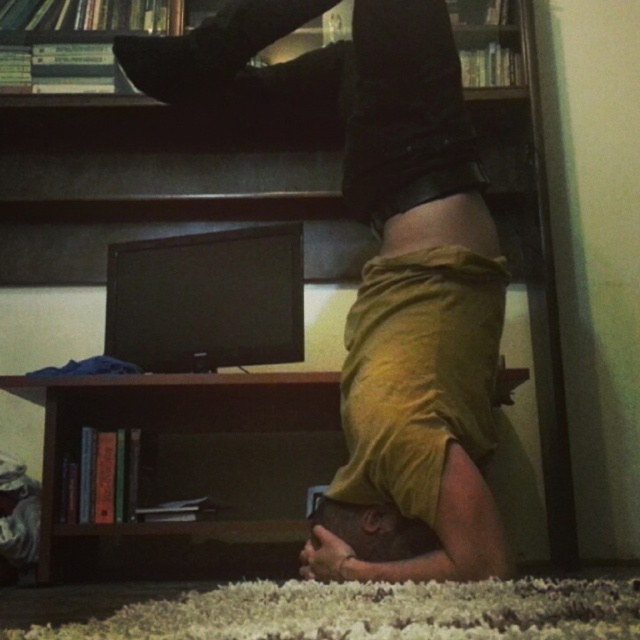
You are trying to hang a picture frame that requires a hook placed at a height of 2 meters. You have two options in the room where the mustard yellow fabric at center and the brown wood bookshelf at lower center are present. Which object would allow you to reach the required height for hanging the picture frame?

The mustard yellow fabric at center is much taller than the brown wood bookshelf at lower center, so you should use the mustard yellow fabric at center to reach the required height of 2 meters for hanging the picture frame.

You are organizing a room and need to place a new decorative item. The mustard yellow fabric at center and the brown wood bookshelf at lower center are in your way. Which object should you move to access the area behind them?

You should move the mustard yellow fabric at center because it is positioned over the brown wood bookshelf at lower center, meaning it is closer to you and blocking access to the area behind both objects.

You are a delivery robot that needs to deliver a package to the brown wood bookshelf at lower center. There is a mustard yellow fabric at center in the way. Can you navigate around it? The robot is 20 inches wide.

The mustard yellow fabric at center is 38.10 inches away from the brown wood bookshelf at lower center. Since the robot is 20 inches wide, it can navigate around the mustard yellow fabric at center as the distance allows sufficient space for maneuvering.